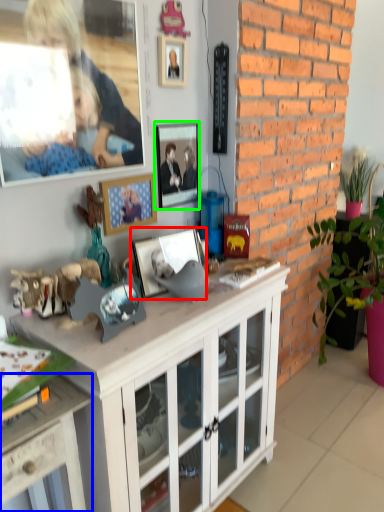
Question: Considering the real-world distances, which object is closest to picture frame (highlighted by a red box)? desk (highlighted by a blue box) or picture frame (highlighted by a green box).

Choices:
 (A) desk
 (B) picture frame

Answer: (B)